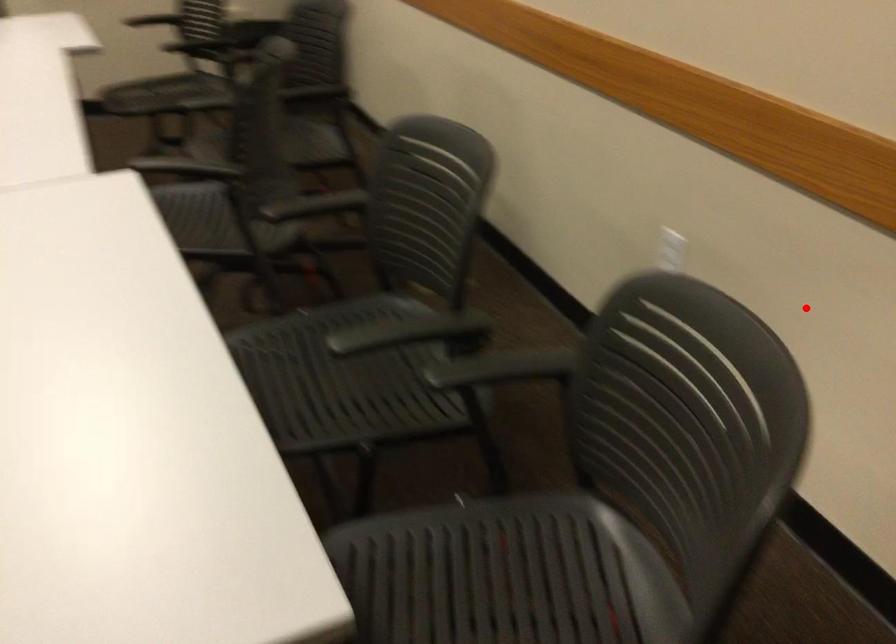
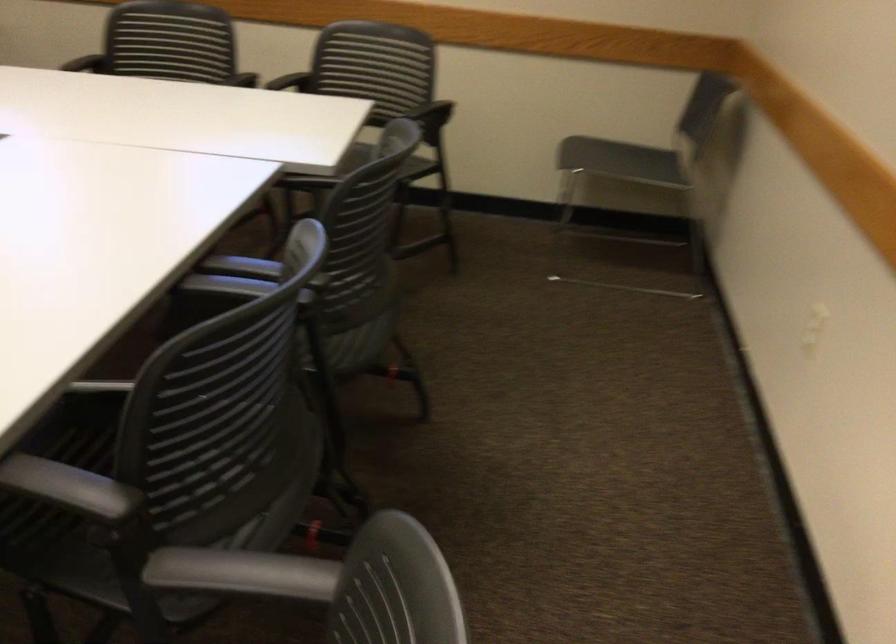
Question: I am providing you with two images of the same scene from different viewpoints. A red point is marked on the first image. At the location where the point appears in image 1, is it still visible in image 2?

Choices:
 (A) Yes
 (B) No

Answer: (A)